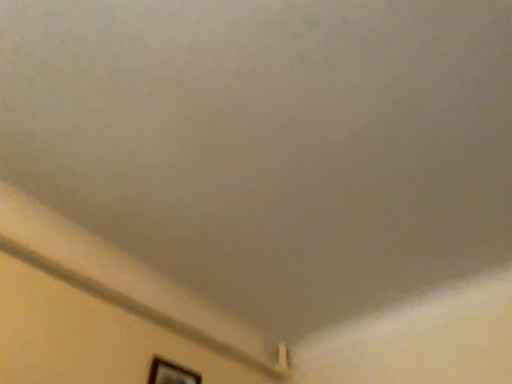
In order to click on wooden picture frame at lower center in this screenshot , I will do `click(170, 373)`.

What do you see at coordinates (170, 373) in the screenshot? I see `wooden picture frame at lower center` at bounding box center [170, 373].

This screenshot has width=512, height=384. Identify the location of wooden picture frame at lower center. (170, 373).